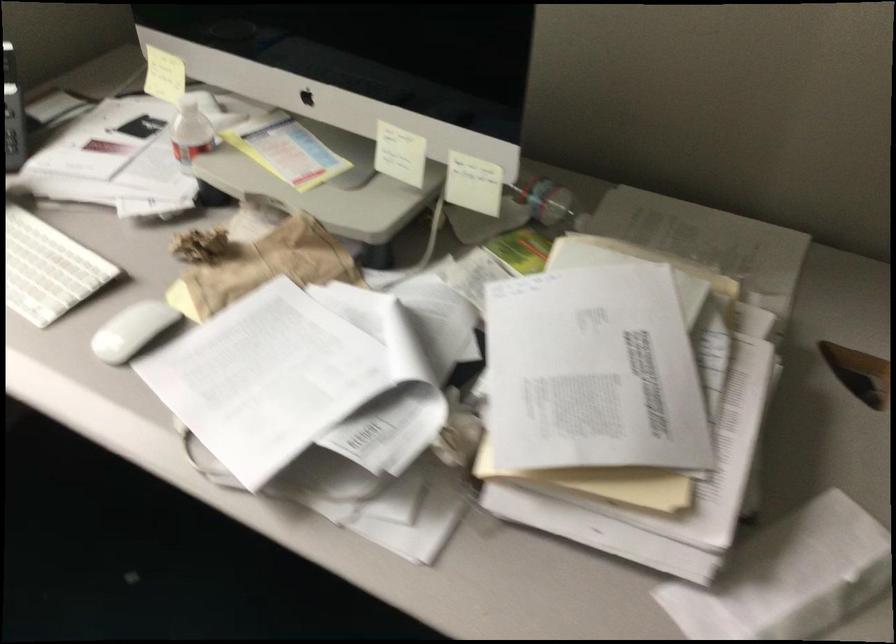
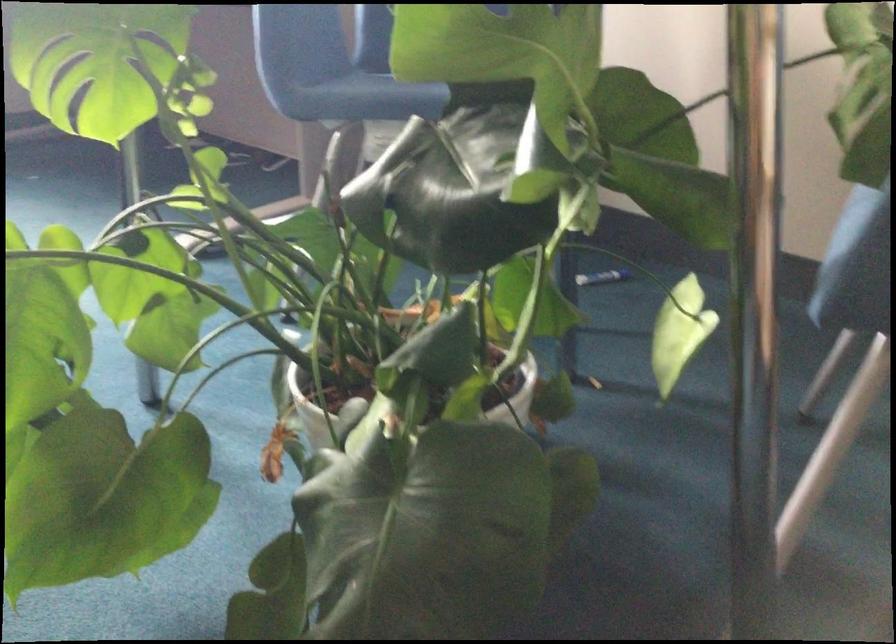
What movement of the cameraman would produce the second image?

The movement direction of the cameraman is right, backward.